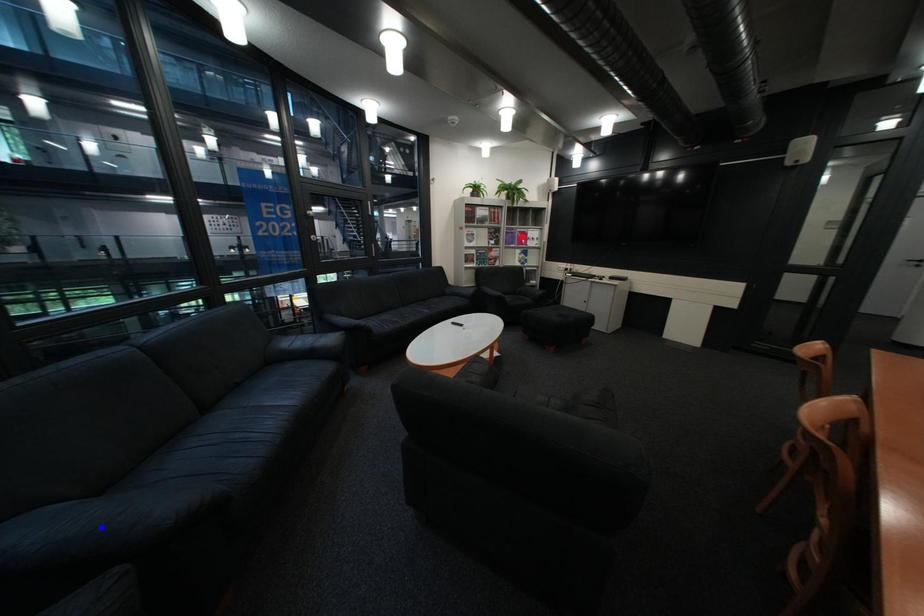
Question: Two points are marked on the image. Which point is closer to the camera?

Choices:
 (A) Blue point is closer.
 (B) Red point is closer.

Answer: (A)